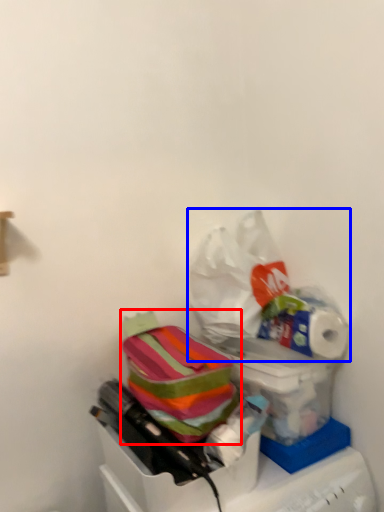
Question: Which of the following is the farthest to the observer, material (highlighted by a red box) or plastic bag (highlighted by a blue box)?

Choices:
 (A) material
 (B) plastic bag

Answer: (B)